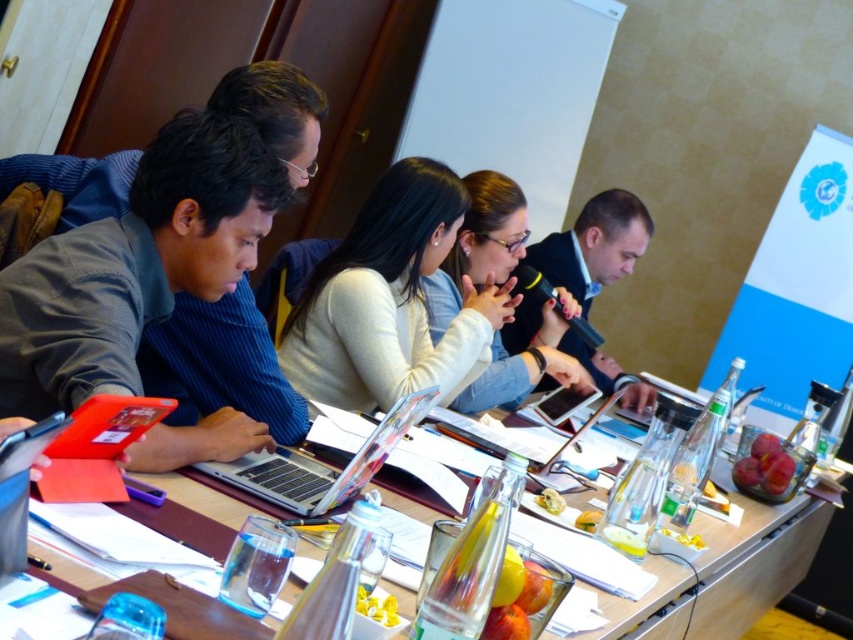
Question: Estimate the real-world distances between objects in this image. Which object is closer to the matte black laptop at left?

Choices:
 (A) silver metallic laptop at center
 (B) matte black microphone at center
 (C) white matte jacket at center

Answer: (A)

Question: Can you confirm if matte black laptop at left is positioned below matte black microphone at center?

Choices:
 (A) yes
 (B) no

Answer: (A)

Question: Which point appears farthest from the camera in this image?

Choices:
 (A) (753, 502)
 (B) (271, 212)
 (C) (500, 305)
 (D) (306, 499)

Answer: (A)

Question: Which point is farther to the camera?

Choices:
 (A) clear plastic water at center
 (B) white matte sweater at center
 (C) matte black laptop at left

Answer: (B)

Question: Is white matte sweater at center below white matte jacket at center?

Choices:
 (A) no
 (B) yes

Answer: (B)

Question: Can you confirm if clear plastic water at center is positioned to the right of silver metallic laptop at center?

Choices:
 (A) yes
 (B) no

Answer: (A)